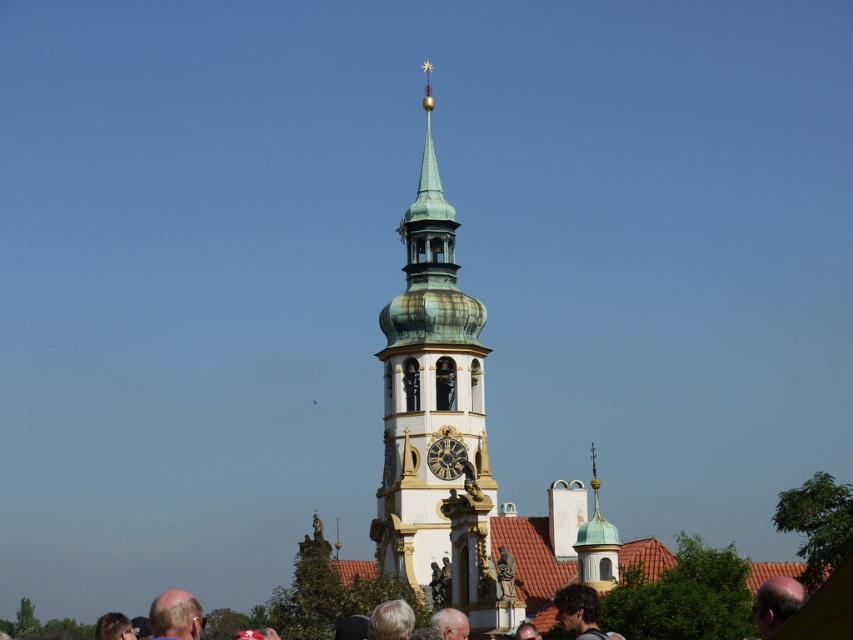
Is dark brown hair at center wider than gold metallic clock at center?

Indeed, dark brown hair at center has a greater width compared to gold metallic clock at center.

Does point (561, 616) lie behind point (453, 476)?

No.

Is point (589, 593) behind point (444, 442)?

No, it is in front of (444, 442).

Where is `dark brown hair at center`? This screenshot has height=640, width=853. dark brown hair at center is located at coordinates (579, 611).

Which is more to the right, green copper clock tower at center or smooth bald head at center?

Positioned to the right is smooth bald head at center.

Can you confirm if green copper clock tower at center is bigger than smooth bald head at center?

Indeed, green copper clock tower at center has a larger size compared to smooth bald head at center.

Locate an element on the screen. The width and height of the screenshot is (853, 640). green copper clock tower at center is located at coordinates [427, 387].

From the picture: How much distance is there between green copper clock tower at center and gold metallic clock at center?

green copper clock tower at center and gold metallic clock at center are 7.82 meters apart from each other.

Is green copper clock tower at center below gold metallic clock at center?

Incorrect, green copper clock tower at center is not positioned below gold metallic clock at center.

Does point (438, 321) lie behind point (445, 470)?

Yes, point (438, 321) is farther from viewer.

Locate an element on the screen. This screenshot has width=853, height=640. green copper clock tower at center is located at coordinates (427, 387).